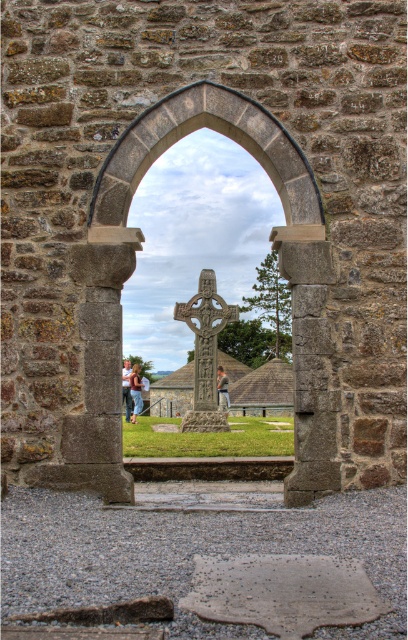
Question: Can you confirm if carved stone cross at center is positioned below brown leather jacket at center?

Choices:
 (A) yes
 (B) no

Answer: (B)

Question: Among these objects, which one is farthest from the camera?

Choices:
 (A) blurred fabric person at center
 (B) brown leather jacket at center

Answer: (B)

Question: Considering the real-world distances, which object is closest to the light brown leather jacket at center?

Choices:
 (A) carved stone cross at center
 (B) blurred fabric person at center

Answer: (A)

Question: Does stone archway at center appear over light brown leather jacket at center?

Choices:
 (A) no
 (B) yes

Answer: (B)

Question: Considering the real-world distances, which object is closest to the light brown leather jacket at center?

Choices:
 (A) gray stone pillar at center
 (B) carved stone cross at center
 (C) blurred fabric person at center

Answer: (B)

Question: Is brown leather jacket at center below blurred fabric person at center?

Choices:
 (A) yes
 (B) no

Answer: (A)